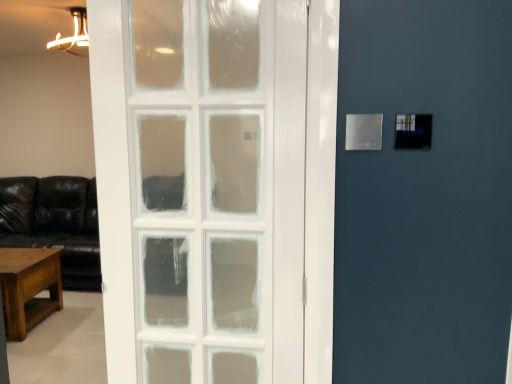
At what (x,y) coordinates should I click in order to perform the action: click on spots to the right of rustic wood table at lower left. Please return your answer as a coordinate pair (x, y). The width and height of the screenshot is (512, 384). Looking at the image, I should click on (69, 326).